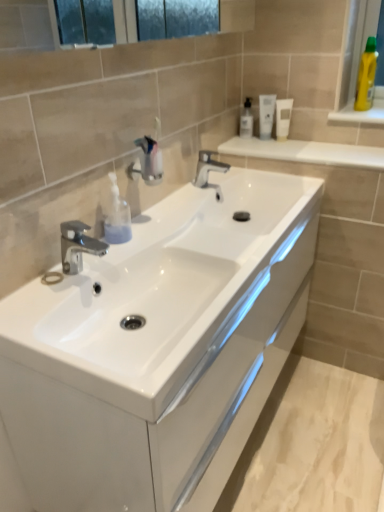
I want to click on free location in front of polished chrome tap at left, which is the first tap in left-to-right order, so click(47, 310).